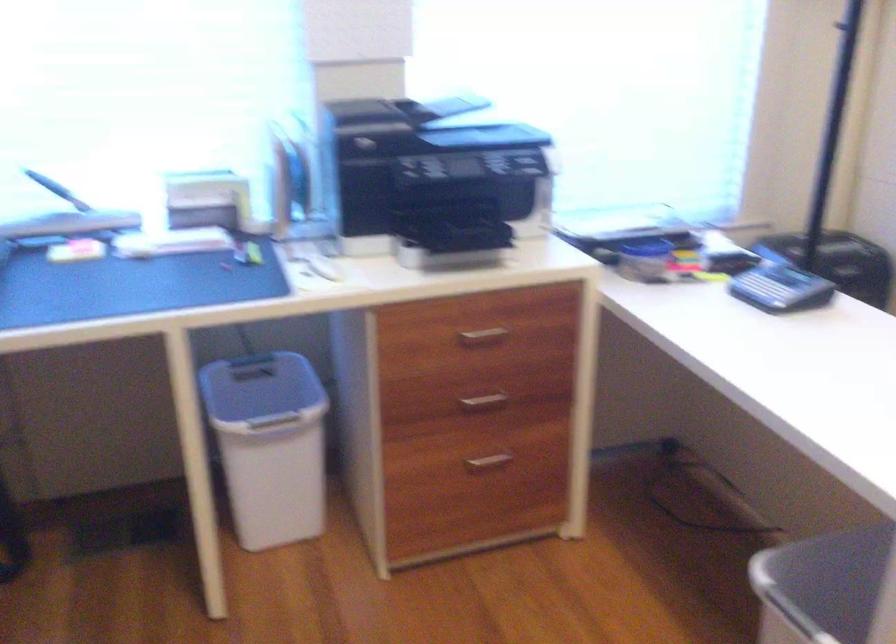
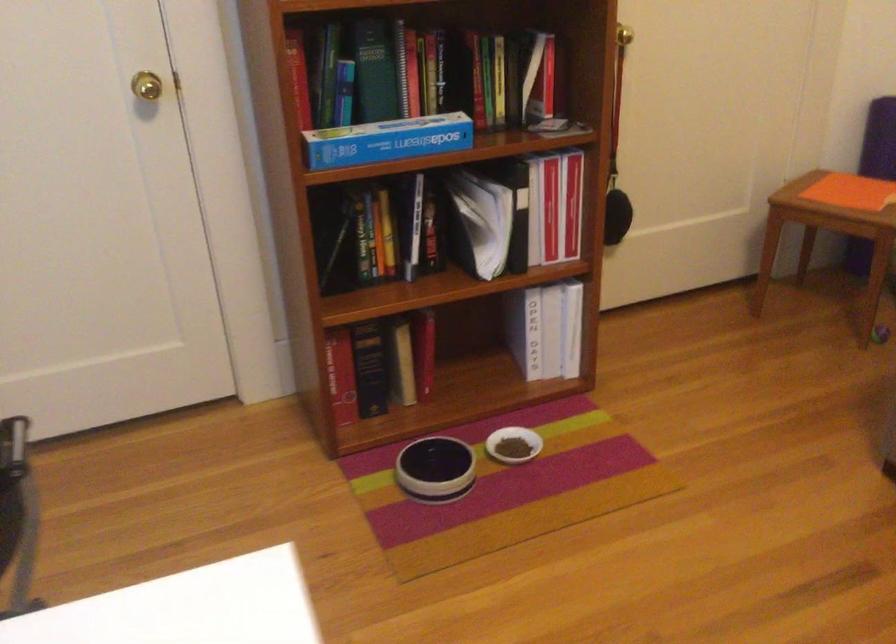
First-person continuous shooting, in which direction is the camera rotating?

The camera's rotation is toward right-down.